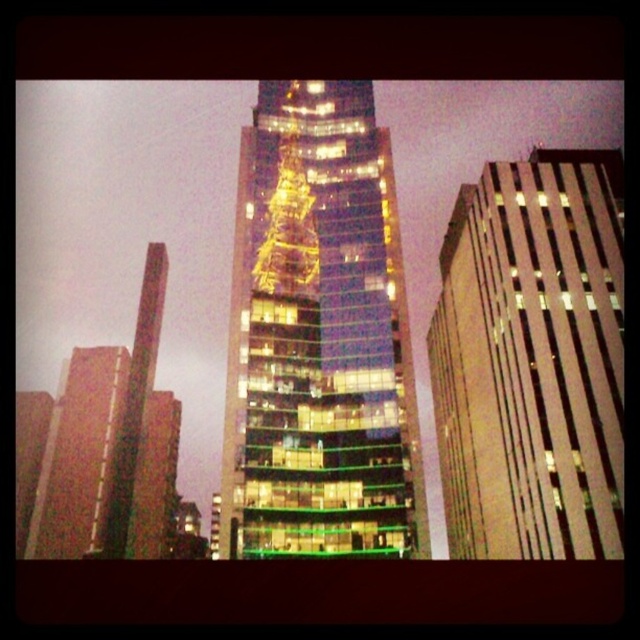
In the scene shown: You are a drone operator tasked with flying a drone between the glass skyscraper at center and the glassy skyscraper at left. The drone has a wingspan of 2 meters. Can the drone safely pass through the space between them?

The distance between the glass skyscraper at center and the glassy skyscraper at left is 62.58 meters, which is significantly wider than the drone wingspan of 2 meters. Yes, the drone can safely pass through the space between them.

You are a city planner analyzing the layout of the city. You need to determine if the glassy reflective skyscraper at center and the glassy reflective building at right can both fit within a proposed 100 meter wide city block. Given their widths, can they be placed side by side without exceeding the block width?

The glassy reflective skyscraper at center might be wider than glassy reflective building at right. However, without exact measurements, it is uncertain if their combined widths exceed 100 meters. Further data is needed to confirm.

You are an architect analyzing the city layout. You notice the glassy reflective building at right and the glassy skyscraper at left. Which building appears closer to the viewer based on their spatial arrangement?

The glassy reflective building at right appears closer to the viewer because it is positioned over the glassy skyscraper at left, indicating it is in front spatially.